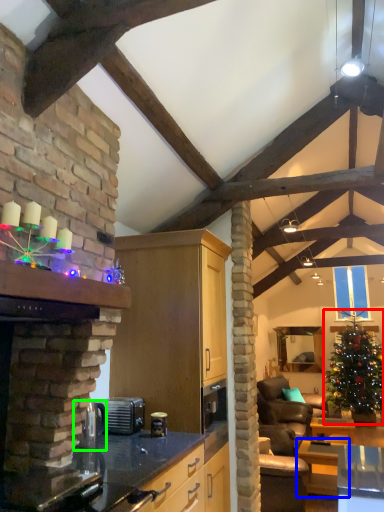
Question: Which is farther away from christmas tree (highlighted by a red box)? table (highlighted by a blue box) or appliance (highlighted by a green box)?

Choices:
 (A) table
 (B) appliance

Answer: (B)